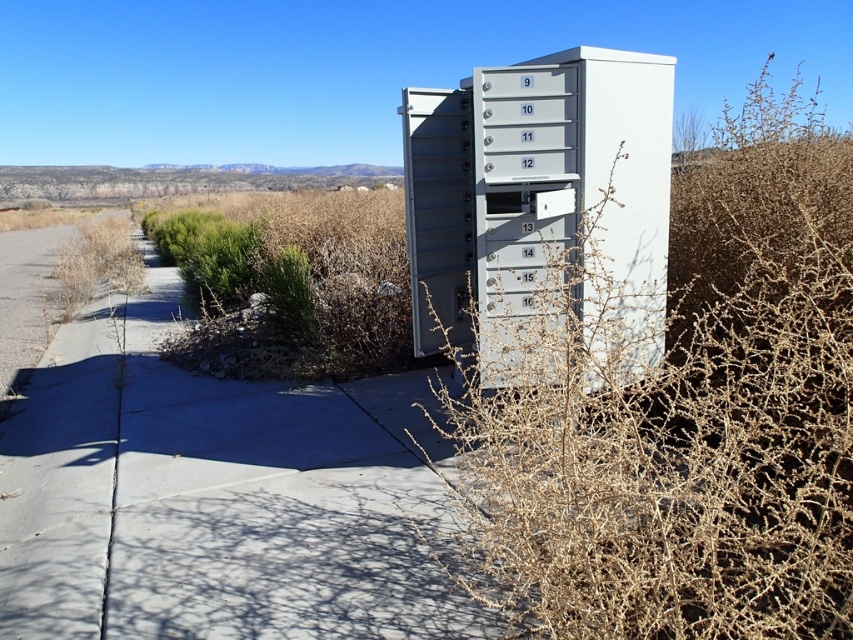
You are a delivery person trying to place a large package on the gray concrete sidewalk at center next to the gray metallic file cabinet at center. Can the package fit on the sidewalk without overlapping the file cabinet?

The gray concrete sidewalk at center is wider than the gray metallic file cabinet at center, so the package can fit on the sidewalk without overlapping the file cabinet.

Based on the photo, you are a delivery person carrying a 3.5 feet wide package and need to place it on the gray concrete sidewalk at center. The gray metallic file cabinet at center is in the way. Can you move the package around the file cabinet to reach the sidewalk?

The gray concrete sidewalk at center is 5.61 feet away from the gray metallic file cabinet at center. Since the package is only 3.5 feet wide, there is enough space to maneuver around the gray metallic file cabinet at center and place the package on the gray concrete sidewalk at center.

You are walking along the gray concrete sidewalk at center and want to reach the brown spiky bush at right. Which direction should you turn to get there?

The brown spiky bush at right is to the right of the gray concrete sidewalk at center, so you should turn right to reach it.